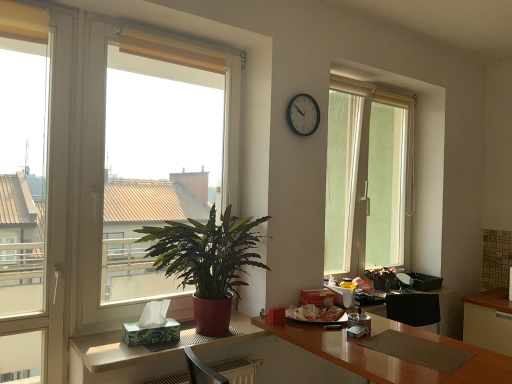
The image size is (512, 384). I want to click on free space in front of white cardboard tissue at lower left, so click(120, 354).